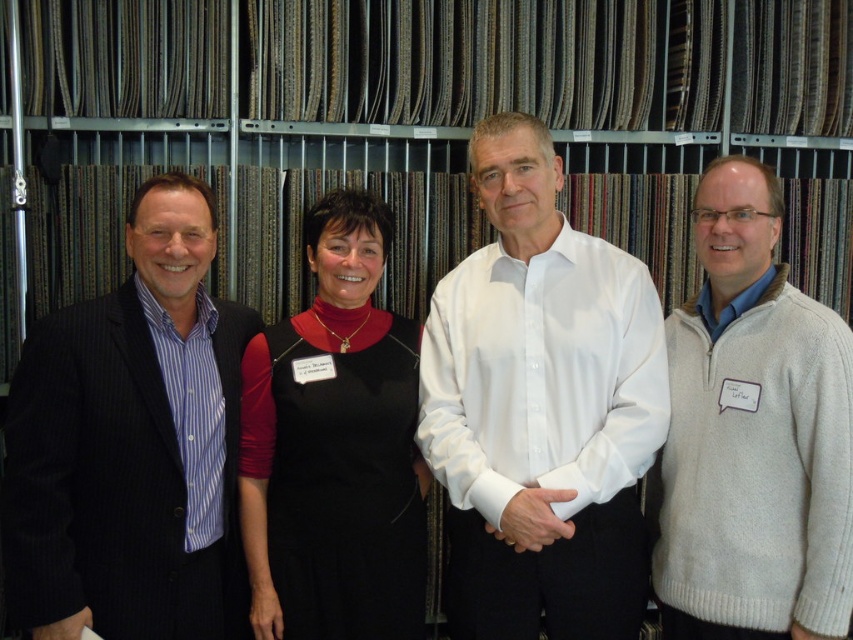
Question: Is white smooth shirt at center behind white knit sweater at right?

Choices:
 (A) no
 (B) yes

Answer: (B)

Question: Which is farther from the white knit sweater at right?

Choices:
 (A) striped cotton shirt at left
 (B) white smooth shirt at center

Answer: (A)

Question: Considering the real-world distances, which object is closest to the white knit sweater at right?

Choices:
 (A) striped cotton shirt at left
 (B) black dress at center
 (C) white smooth shirt at center

Answer: (C)

Question: Is white knit sweater at right to the right of black dress at center from the viewer's perspective?

Choices:
 (A) no
 (B) yes

Answer: (B)

Question: Which object is the farthest from the black dress at center?

Choices:
 (A) striped cotton shirt at left
 (B) white knit sweater at right
 (C) white smooth shirt at center

Answer: (B)

Question: In this image, where is white knit sweater at right located relative to black dress at center?

Choices:
 (A) above
 (B) below

Answer: (A)